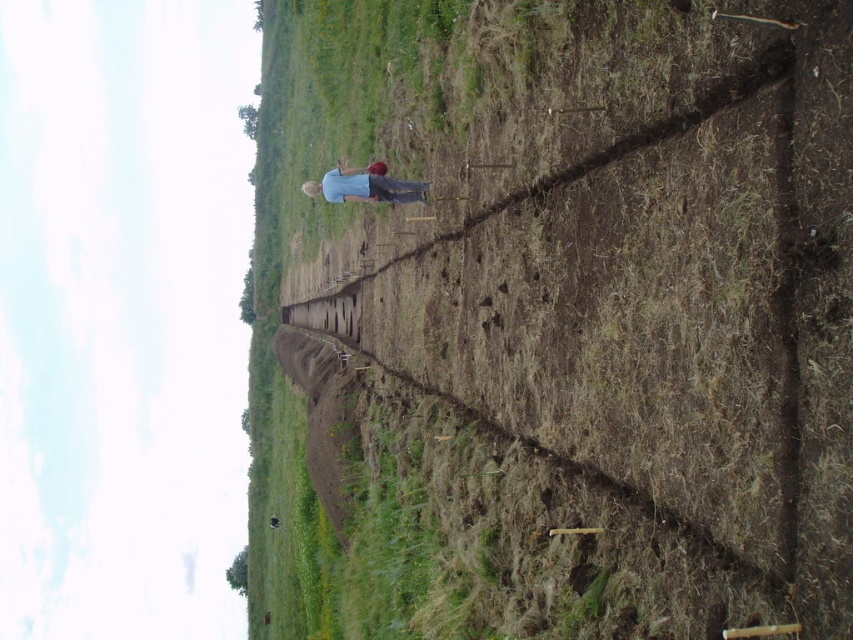
Does brown soil at center lie behind blue cotton shirt at center?

No, brown soil at center is closer to the viewer.

Identify the location of brown soil at center. (561, 314).